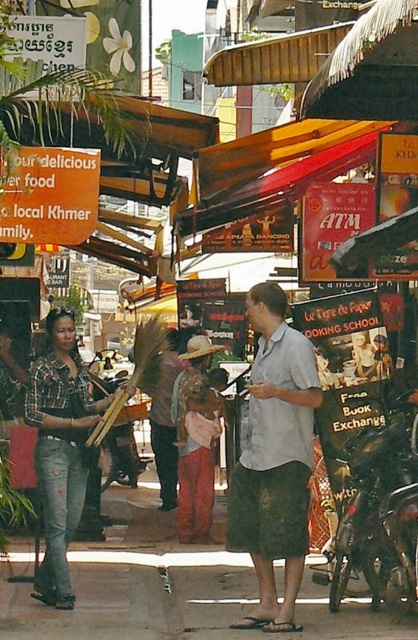
Question: Is denim jeans at center behind shiny black motorcycle at center?

Choices:
 (A) no
 (B) yes

Answer: (B)

Question: Which object appears closest to the camera in this image?

Choices:
 (A) shiny black motorcycle at center
 (B) denim jeans at center

Answer: (A)

Question: Which point is farther to the camera?

Choices:
 (A) (336, 605)
 (B) (71, 531)
 (C) (265, 500)

Answer: (B)

Question: Can you confirm if light gray cotton shirt at center is positioned below shiny black motorcycle at center?

Choices:
 (A) yes
 (B) no

Answer: (B)

Question: Is light gray cotton shirt at center above shiny black motorcycle at center?

Choices:
 (A) yes
 (B) no

Answer: (A)

Question: Among these points, which one is farthest from the camera?

Choices:
 (A) [x=51, y=436]
 (B) [x=267, y=502]

Answer: (A)